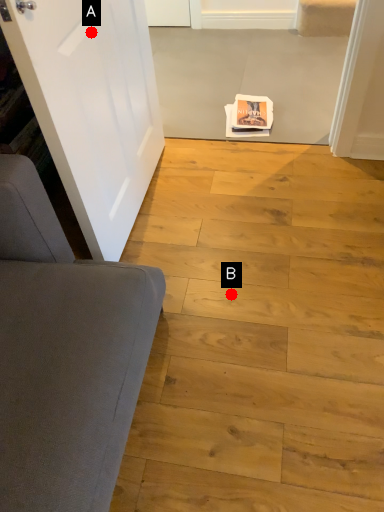
Question: Two points are circled on the image, labeled by A and B beside each circle. Which of the following is the farthest from the observer?

Choices:
 (A) A is further
 (B) B is further

Answer: (B)